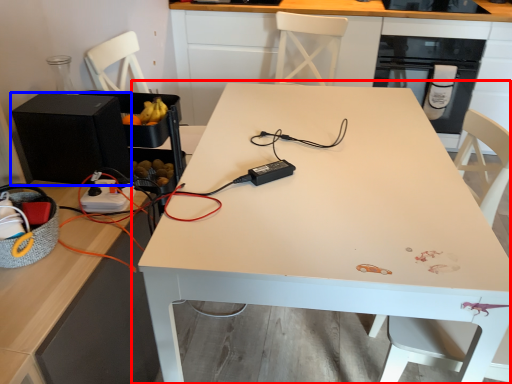
Question: Which object is closer to the camera taking this photo, table (highlighted by a red box) or appliance (highlighted by a blue box)?

Choices:
 (A) table
 (B) appliance

Answer: (A)